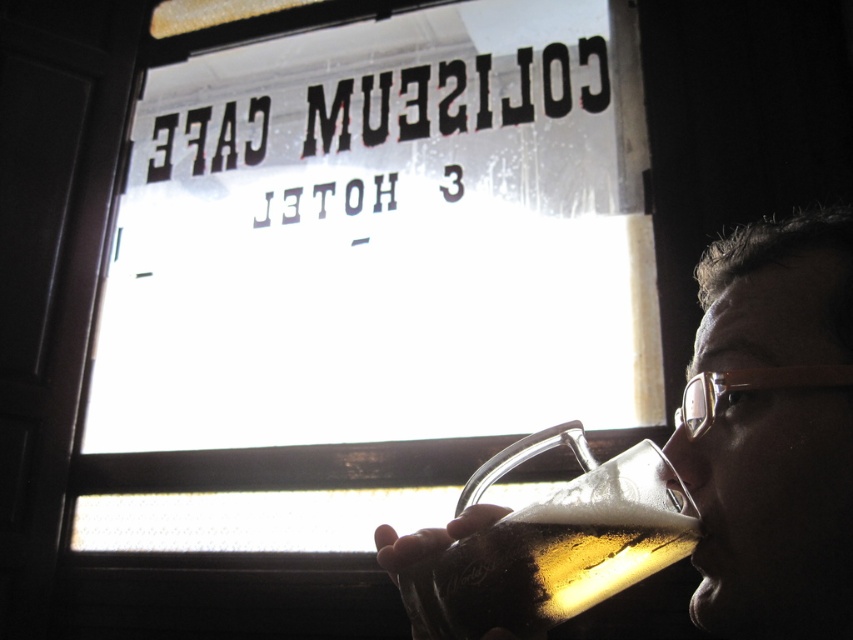
You are a delivery person who needs to place a package on the counter between the transparent glass window at center and the translucent glass mug at upper center. Can you fit the package if it measures 5 feet in length?

The distance between the transparent glass window at center and the translucent glass mug at upper center is 5.34 feet, so yes, the package measuring 5 feet in length can fit between them.

You are a customer at COLISEUM CAFE AND HOTEL. You want to look outside through the transparent glass window at center but your view is blocked by the translucent glass mug at lower center. Which object should you move to the side to get an unobstructed view?

To get an unobstructed view of the transparent glass window at center, you should move the translucent glass mug at lower center to the side since the window is to the left of the mug.